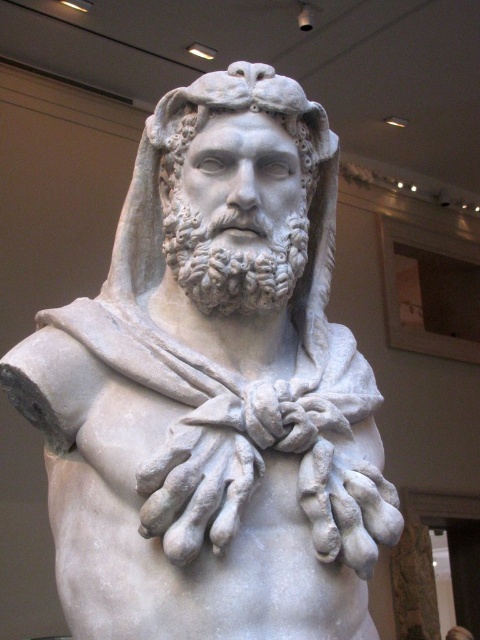
Consider the image. You are an art conservator assessing the dimensions of the sculpture. Given that the white marble hands at center are 30 cm in width, can you determine if the white marble head at center is wider than 30 cm?

The white marble head at center might be wider than white marble hands at center, which are 30 cm in width. Therefore, the head could potentially be wider than 30 cm.

In the scene shown: You are an art conservator examining the marble bust sculpture. You notice two points of concern marked at coordinates point (144, 129) and point (205, 492). Which point is located closer to the back of the sculpture?

Point (144, 129) is behind point (205, 492), so it is closer to the back of the sculpture.

You are an art student analyzing the classical marble sculpture. You notice the white marble head at center and the white marble hands at center. From your perspective, which object is positioned to the right?

The white marble head at center is positioned to the right of the white marble hands at center.